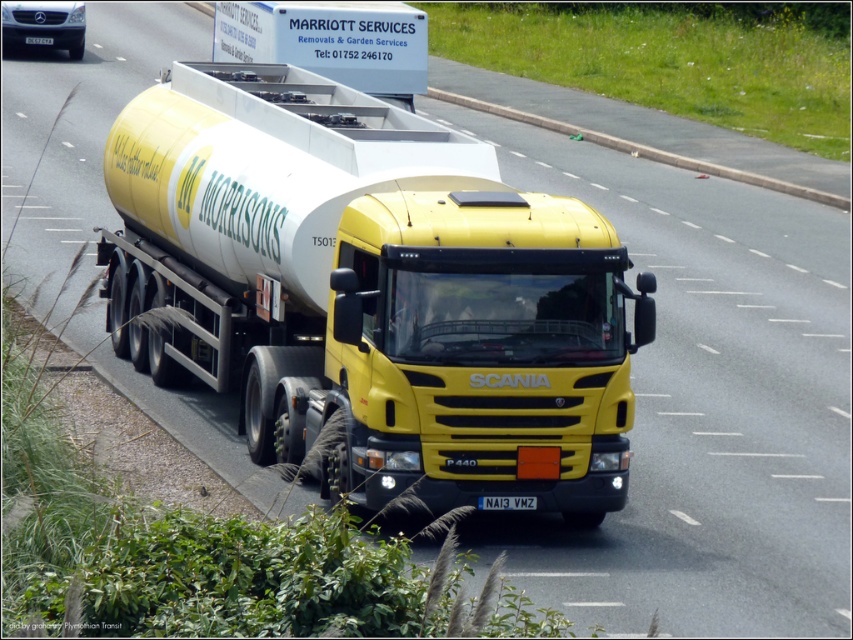
What are the coordinates of the yellow matte trailer truck at center?

The yellow matte trailer truck at center is located at coordinates point (370,292).